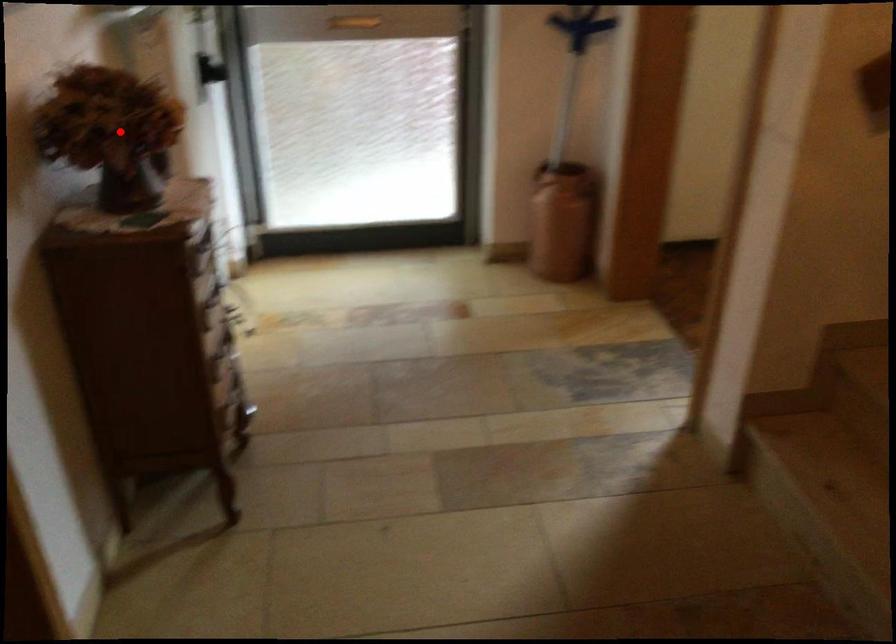
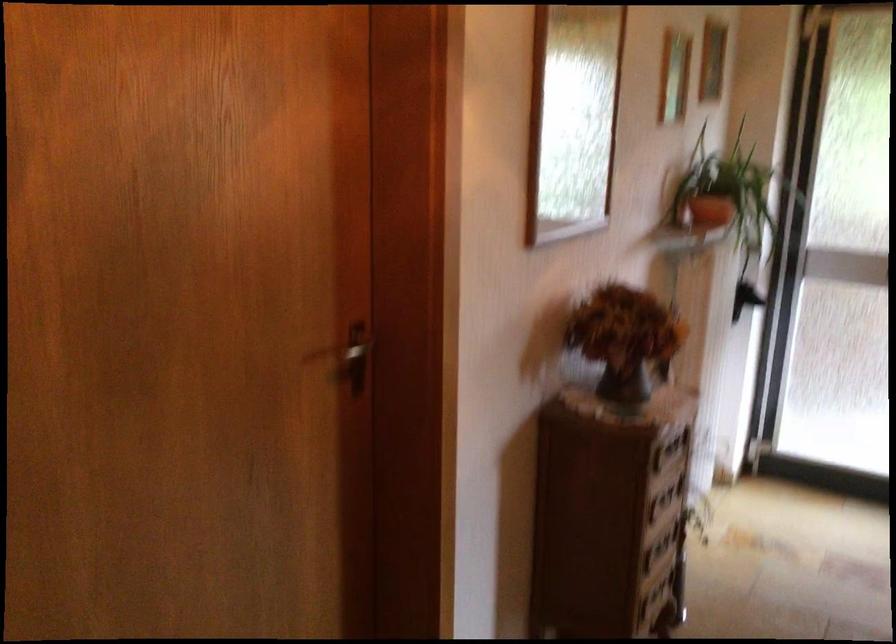
Question: I am providing you with two images of the same scene from different viewpoints. A red point is shown in image1. For the corresponding object point in image2, is it positioned nearer or farther from the camera?

Choices:
 (A) Nearer
 (B) Farther

Answer: (B)